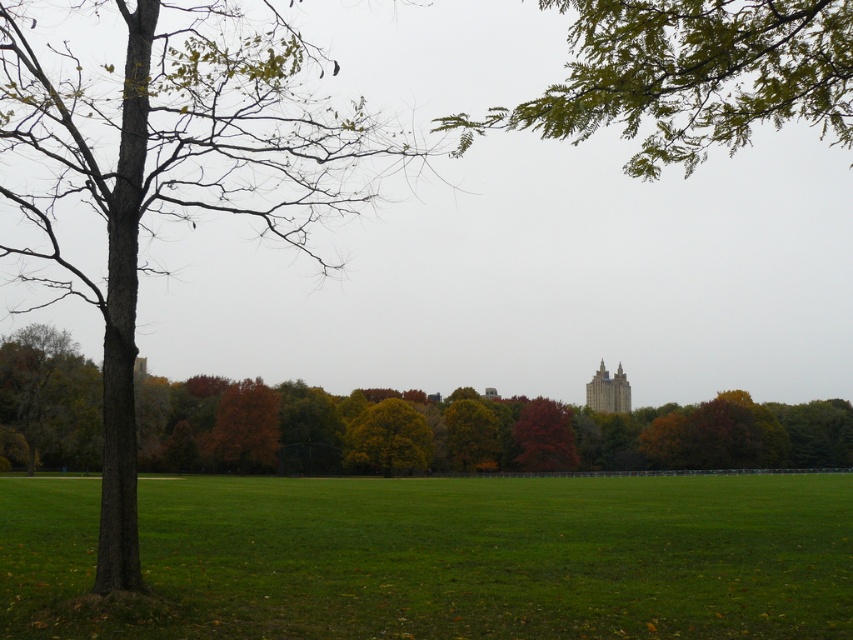
Is green matte tree at left bigger than shiny red tree at center?

Yes.

Can you confirm if green matte tree at left is positioned below shiny red tree at center?

Incorrect, green matte tree at left is not positioned below shiny red tree at center.

You are a GUI agent. You are given a task and a screenshot of the screen. Output one action in this format:
    pyautogui.click(x=<x>, y=<y>)
    Task: Click on the green matte tree at left
    
    Given the screenshot: What is the action you would take?
    pyautogui.click(x=316, y=428)

The image size is (853, 640). In order to click on green matte tree at left in this screenshot , I will do `click(316, 428)`.

Does green leafy branches at upper center appear under smooth gray stone tower at center?

Incorrect, green leafy branches at upper center is not positioned below smooth gray stone tower at center.

Does green leafy branches at upper center have a smaller size compared to smooth gray stone tower at center?

No, green leafy branches at upper center is not smaller than smooth gray stone tower at center.

Identify the location of green leafy branches at upper center. This screenshot has width=853, height=640. (689, 76).

Is point (398, 420) farther from viewer compared to point (254, 401)?

Yes.

This screenshot has width=853, height=640. What do you see at coordinates (387, 436) in the screenshot? I see `green leafy tree at center` at bounding box center [387, 436].

You are a GUI agent. You are given a task and a screenshot of the screen. Output one action in this format:
    pyautogui.click(x=<x>, y=<y>)
    Task: Click on the green leafy tree at center
    This screenshot has width=853, height=640.
    Given the screenshot: What is the action you would take?
    pyautogui.click(x=387, y=436)